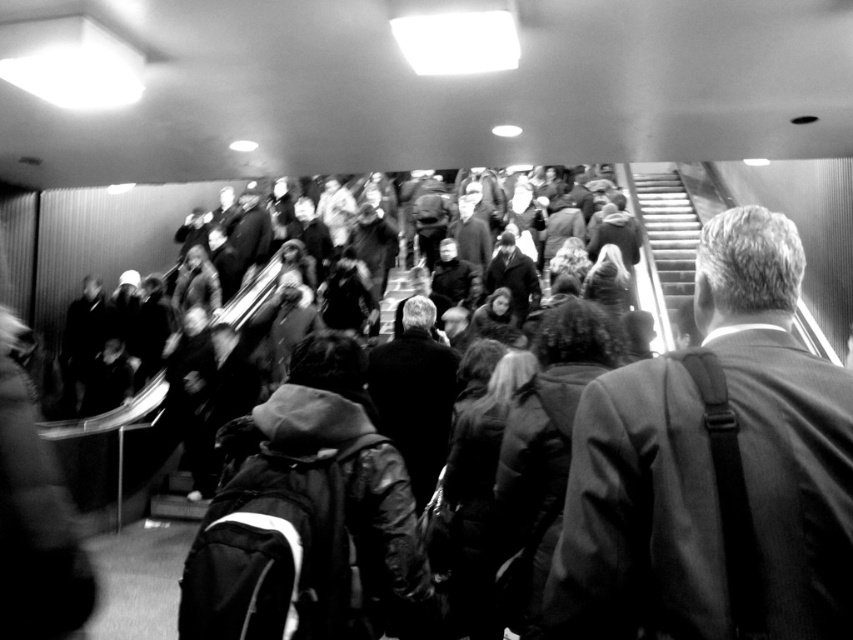
Question: Is suit at center below metallic silver escalator at upper right?

Choices:
 (A) yes
 (B) no

Answer: (A)

Question: Is suit at center positioned before metallic silver escalator at upper right?

Choices:
 (A) yes
 (B) no

Answer: (A)

Question: Among these objects, which one is farthest from the camera?

Choices:
 (A) metallic silver escalator at upper right
 (B) suit at center
 (C) dark gray hooded jacket at center

Answer: (A)

Question: Which point is closer to the camera?

Choices:
 (A) (351, 340)
 (B) (651, 177)
 (C) (740, 230)

Answer: (C)

Question: Is dark gray hooded jacket at center in front of metallic silver escalator at upper right?

Choices:
 (A) yes
 (B) no

Answer: (A)

Question: Based on their relative distances, which object is farther from the suit at center?

Choices:
 (A) dark gray hooded jacket at center
 (B) metallic silver escalator at upper right

Answer: (B)